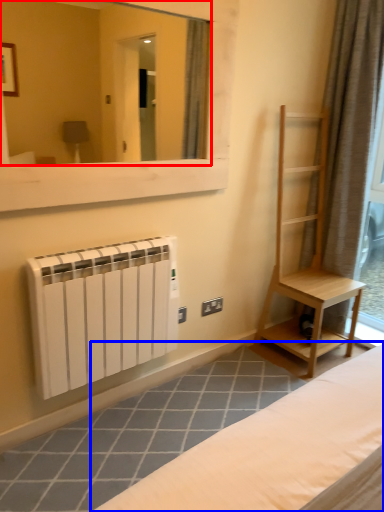
Question: Which object appears farthest to the camera in this image, mirror (highlighted by a red box) or furniture (highlighted by a blue box)?

Choices:
 (A) mirror
 (B) furniture

Answer: (B)